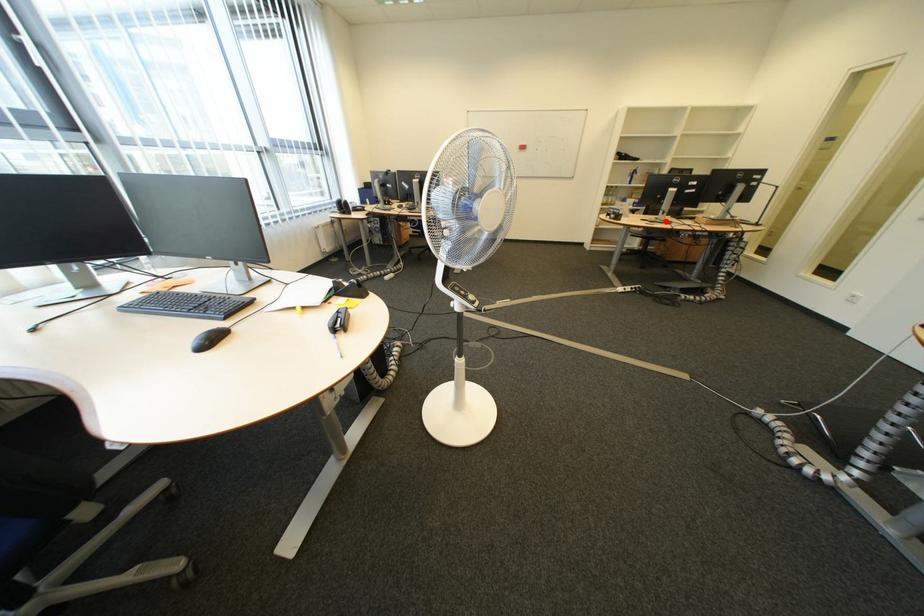
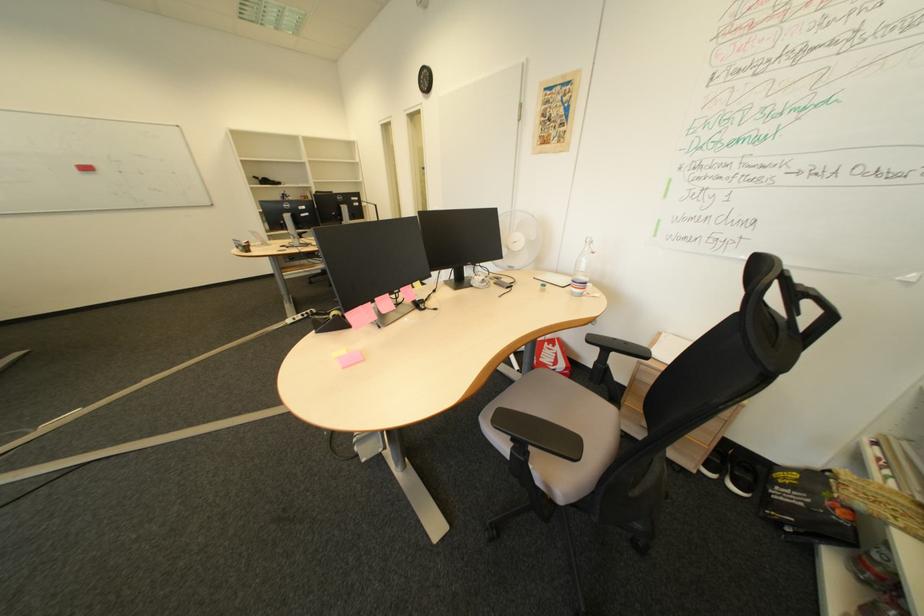
Question: I am providing you with two images of the same scene from different viewpoints. A red point is shown in image1. For the corresponding object point in image2, is it positioned nearer or farther from the camera?

Choices:
 (A) Nearer
 (B) Farther

Answer: (B)